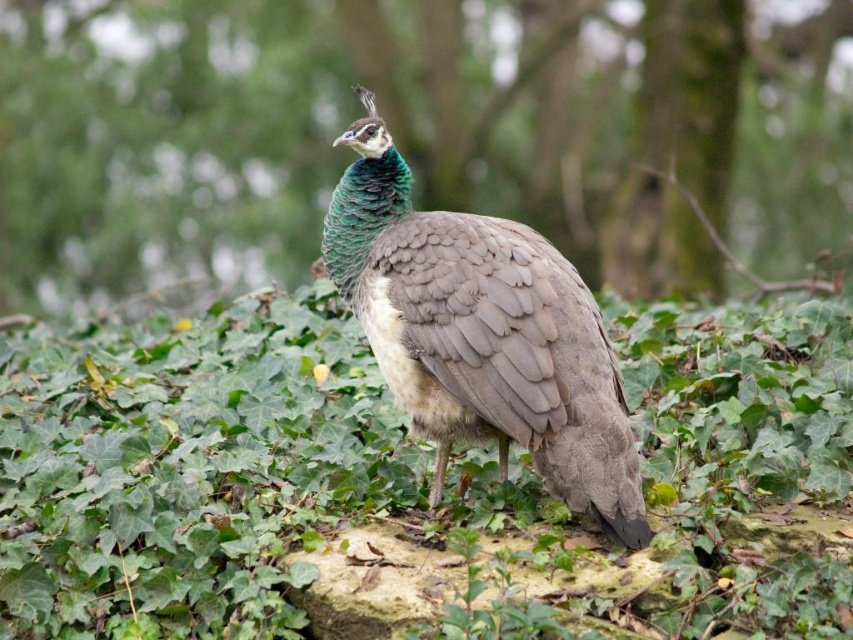
Does point (0, 240) come closer to viewer compared to point (622, 442)?

No.

Between green leafy tree at center and shiny green peacock at center, which one appears on the right side from the viewer's perspective?

shiny green peacock at center is more to the right.

Looking at this image, who is more distant from viewer, [129,224] or [398,396]?

The point [129,224] is behind.

This screenshot has width=853, height=640. Identify the location of green leafy tree at center. (416, 132).

Does green leafy tree at center have a larger size compared to green leafy grass at center?

Correct, green leafy tree at center is larger in size than green leafy grass at center.

Does green leafy tree at center have a lesser width compared to green leafy grass at center?

Incorrect, green leafy tree at center's width is not less than green leafy grass at center's.

At what (x,y) coordinates should I click in order to perform the action: click on green leafy tree at center. Please return your answer as a coordinate pair (x, y). Looking at the image, I should click on (x=416, y=132).

You are a GUI agent. You are given a task and a screenshot of the screen. Output one action in this format:
    pyautogui.click(x=<x>, y=<y>)
    Task: Click on the green leafy tree at center
    
    Given the screenshot: What is the action you would take?
    pyautogui.click(x=416, y=132)

In the scene shown: Is green leafy grass at center smaller than shiny green peacock at center?

Actually, green leafy grass at center might be larger than shiny green peacock at center.

Is green leafy grass at center below shiny green peacock at center?

Yes.

The width and height of the screenshot is (853, 640). I want to click on green leafy grass at center, so pyautogui.click(x=187, y=467).